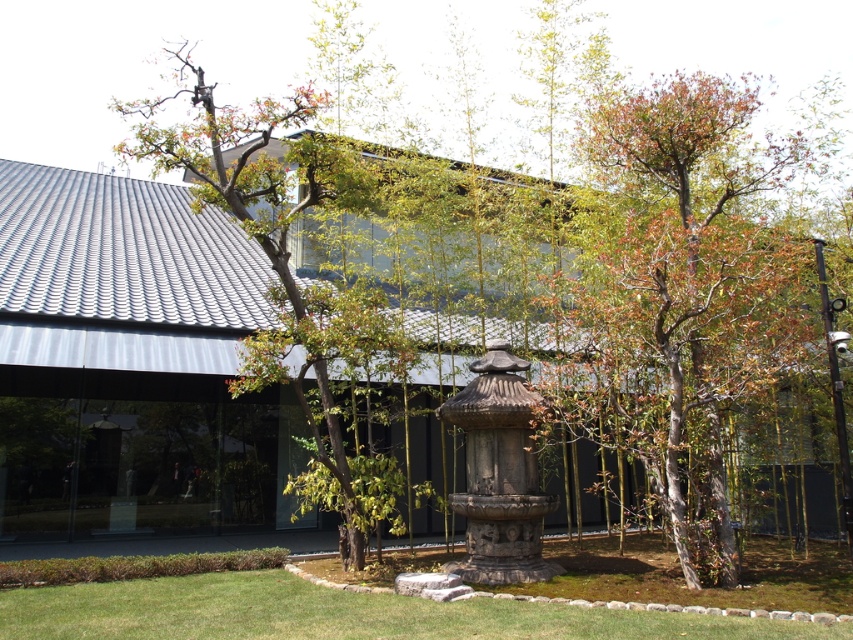
Question: From the image, what is the correct spatial relationship of smooth gray stone statue at center in relation to green leafy tree at upper center?

Choices:
 (A) left
 (B) right

Answer: (B)

Question: Based on their relative distances, which object is farther from the green leafy tree at upper center?

Choices:
 (A) green grass at lower center
 (B) smooth gray stone statue at center

Answer: (A)

Question: Which point is farther to the camera?

Choices:
 (A) (685, 184)
 (B) (581, 627)
 (C) (271, 113)

Answer: (A)

Question: Which object appears closest to the camera in this image?

Choices:
 (A) green grass at lower center
 (B) green leafy tree at upper center
 (C) smooth gray stone statue at center

Answer: (A)

Question: Can you confirm if smooth gray stone statue at center is positioned above green leafy tree at upper center?

Choices:
 (A) yes
 (B) no

Answer: (B)

Question: Does smooth gray stone statue at center come behind green grass at lower center?

Choices:
 (A) yes
 (B) no

Answer: (A)